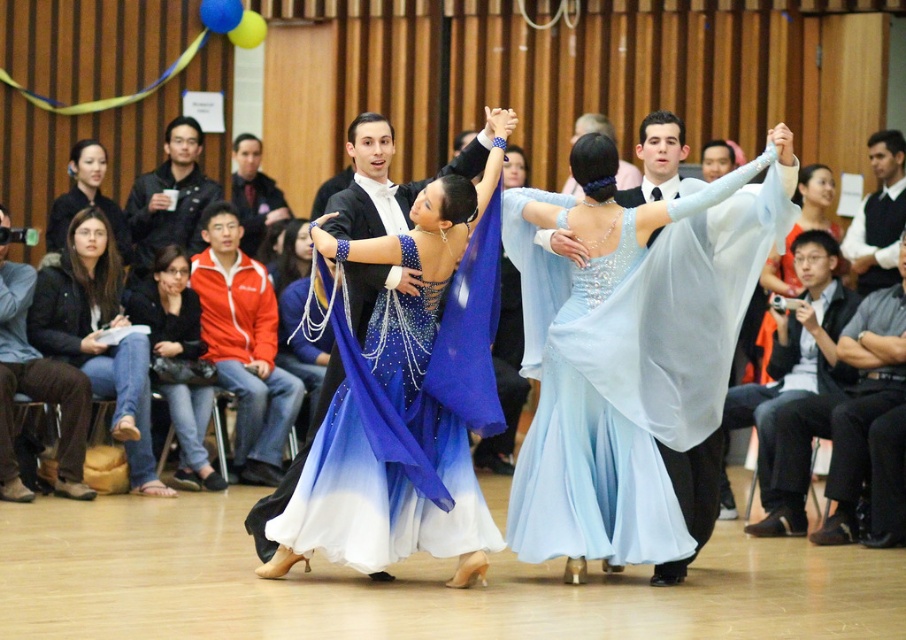
Consider the image. You are a photographer in the ballroom and want to capture both the blue satin dress at center and the red fleece jacket at center in a single photo. Which object should you focus on first to ensure both are in frame?

The blue satin dress at center is shorter than the red fleece jacket at center, so you should focus on the red fleece jacket at center first to ensure both are in frame.

You are a photographer positioned at the back of the ballroom. You want to capture a photo of the shiny blue dress at center without including the brown leather boots at lower left in the frame. Which direction should you move to ensure the boots are out of the shot?

The brown leather boots at lower left are to the left of the shiny blue dress at center. To exclude the boots from the frame, move to the right side of the ballroom so that the shiny blue dress at center remains centered while the boots are no longer visible to the left.